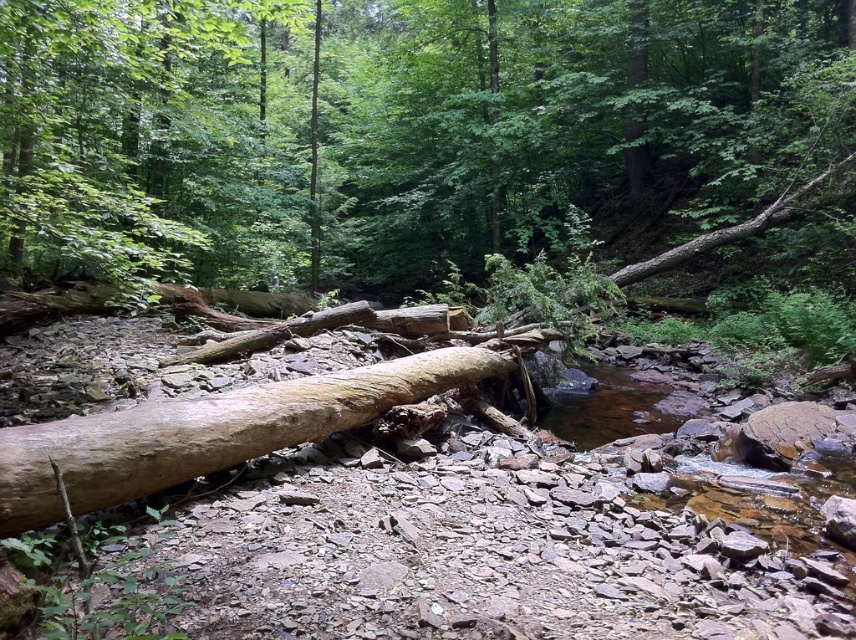
Question: Which point is closer to the camera?

Choices:
 (A) light brown wood log at center
 (B) brown rough log at center

Answer: (A)

Question: Which point appears farthest from the camera in this image?

Choices:
 (A) (354, 392)
 (B) (788, 193)

Answer: (B)

Question: Observing the image, what is the correct spatial positioning of brown rough log at center in reference to light brown wood log at center?

Choices:
 (A) right
 (B) left

Answer: (B)

Question: Is the position of brown rough log at center less distant than that of light brown wood log at center?

Choices:
 (A) no
 (B) yes

Answer: (A)

Question: Is brown rough log at center closer to the viewer compared to light brown wood log at center?

Choices:
 (A) no
 (B) yes

Answer: (A)